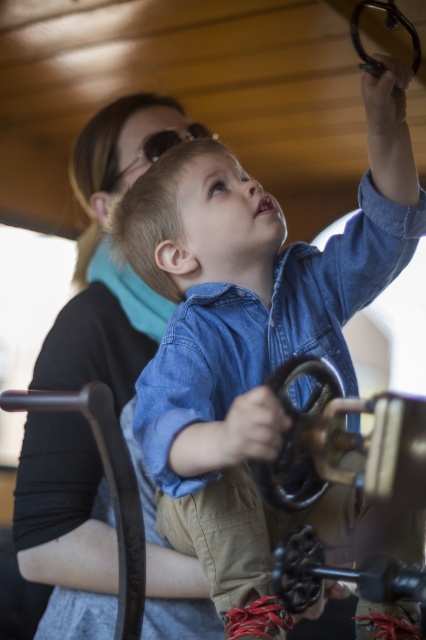
Question: Can you confirm if denim shirt at upper center is positioned below matte black goggles at upper center?

Choices:
 (A) no
 (B) yes

Answer: (B)

Question: Estimate the real-world distances between objects in this image. Which object is closer to the black matte shirt at upper left?

Choices:
 (A) denim shirt at upper center
 (B) matte black goggles at upper center

Answer: (B)

Question: Does denim shirt at upper center appear on the left side of black matte shirt at upper left?

Choices:
 (A) yes
 (B) no

Answer: (B)

Question: Among these objects, which one is farthest from the camera?

Choices:
 (A) matte black goggles at upper center
 (B) denim shirt at upper center
 (C) black matte shirt at upper left

Answer: (A)

Question: Is black matte shirt at upper left further to camera compared to matte black goggles at upper center?

Choices:
 (A) no
 (B) yes

Answer: (A)

Question: Among these points, which one is nearest to the camera?

Choices:
 (A) (189, 177)
 (B) (218, 636)

Answer: (A)